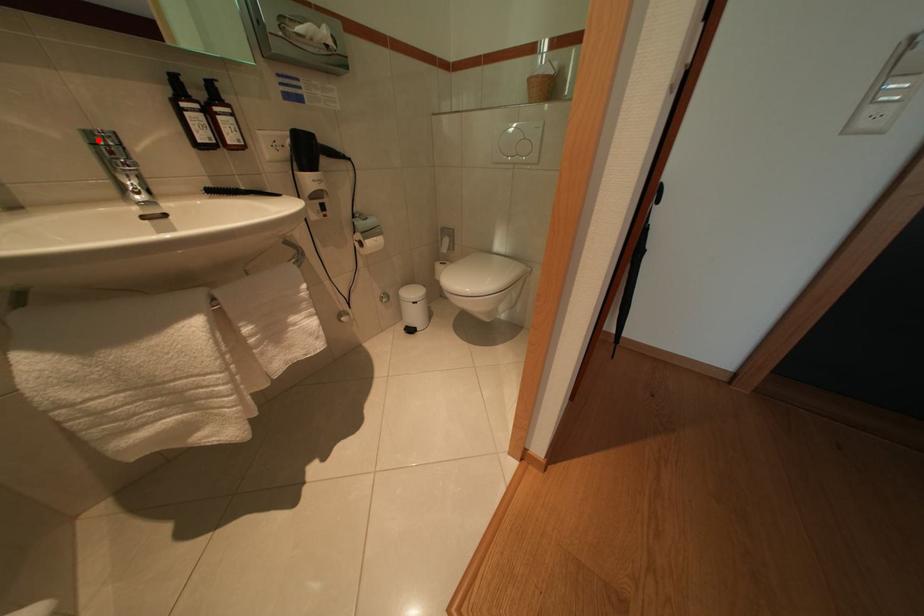
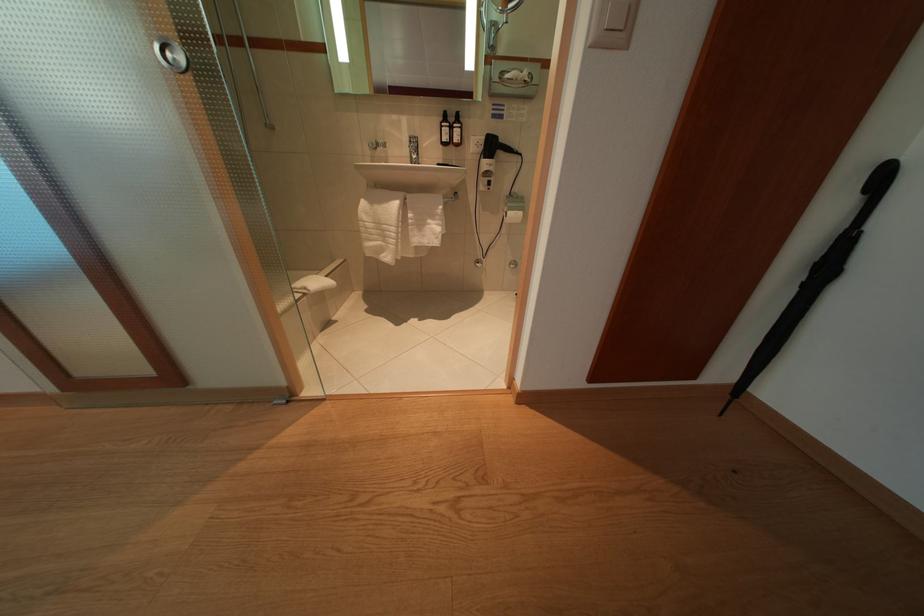
Question: I am providing you with two images of the same scene from different viewpoints. In image1, a red point is highlighted. Considering the same 3D point in image2, which of the following is correct?

Choices:
 (A) It is closer
 (B) It is farther

Answer: (A)